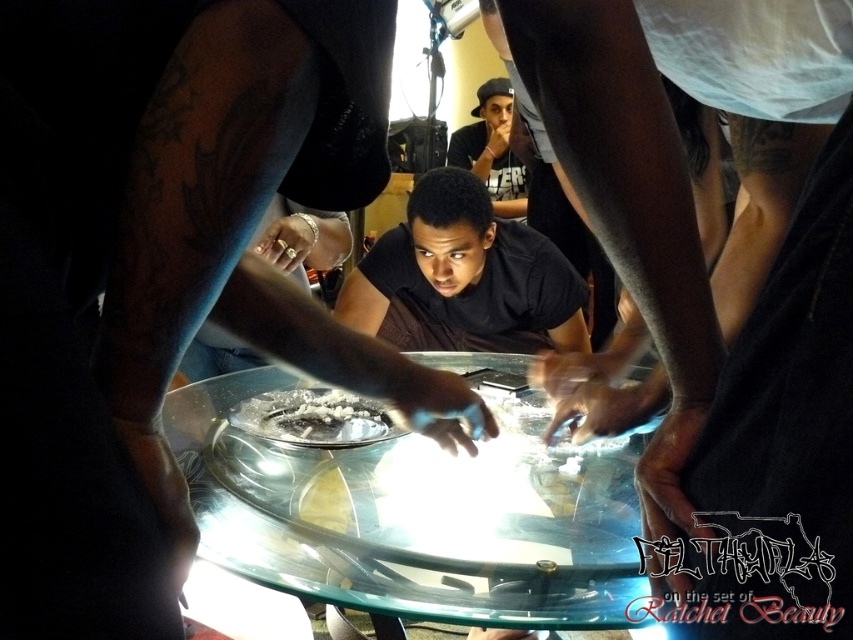
You are a camera operator trying to focus on two points in the scene. The first point is at coordinates point (473, 275) and the second is at point (453, 163). Which point should you adjust your focus to first to capture the closest object?

Point (473, 275) is closer to the viewer than point (453, 163), so you should adjust your focus to point (473, 275) first to capture the closest object.

Consider the image. You are a prop designer working on the set of the show mentioned in the scene. You need to place a decorative item that is 15 centimeters wide on the table. Based on the distance between the transparent glass table at center and the white powder at center, will the item fit between them?

The distance between the transparent glass table at center and the white powder at center is 14.91 centimeters. Since the decorative item is 15 centimeters wide, it will not fit between them as the space is slightly narrower.

You are a prop designer working on the set of the film. You need to place a new decorative item on the table. According to the scene, where exactly is the transparent glass table at center located in relation to the white powder at center?

The transparent glass table at center is to the right of the white powder at center.